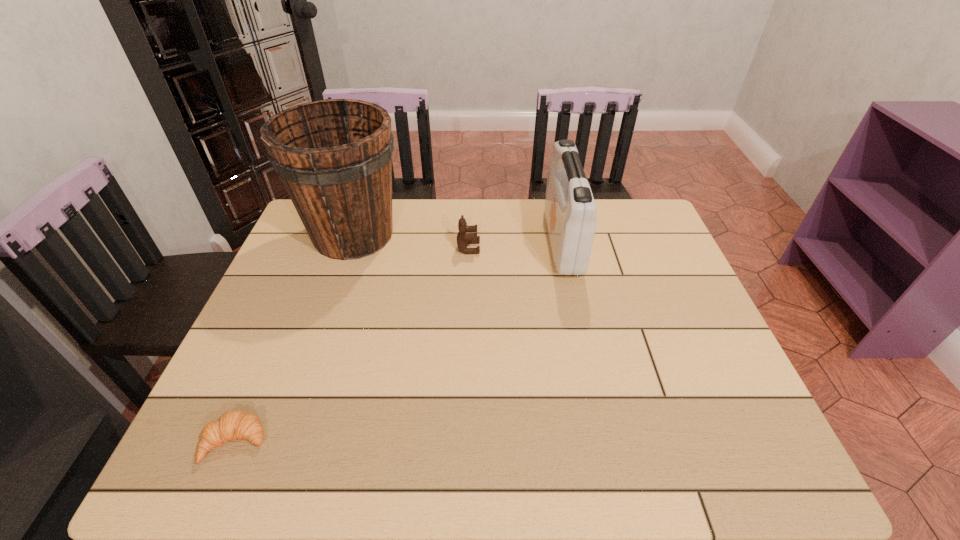
This screenshot has width=960, height=540. Identify the location of the tallest object. (334, 157).

Image resolution: width=960 pixels, height=540 pixels. I want to click on the third shortest object, so point(570,211).

What are the coordinates of `the rightmost object` in the screenshot? It's located at (570, 211).

Find the location of a particular element. the second object from right to left is located at coordinates (463, 239).

The width and height of the screenshot is (960, 540). Find the location of `the third tallest object`. the third tallest object is located at coordinates (463, 239).

I want to click on the nearest object, so click(x=232, y=425).

Locate an element on the screen. the shortest object is located at coordinates (232, 425).

I want to click on blank area located on the front of the tallest object, so point(328,309).

Where is `vacant space situated on the front side of the third shortest object`? vacant space situated on the front side of the third shortest object is located at coordinates (512, 242).

The height and width of the screenshot is (540, 960). What are the coordinates of `blank space located on the front side of the third shortest object` in the screenshot? It's located at (495, 242).